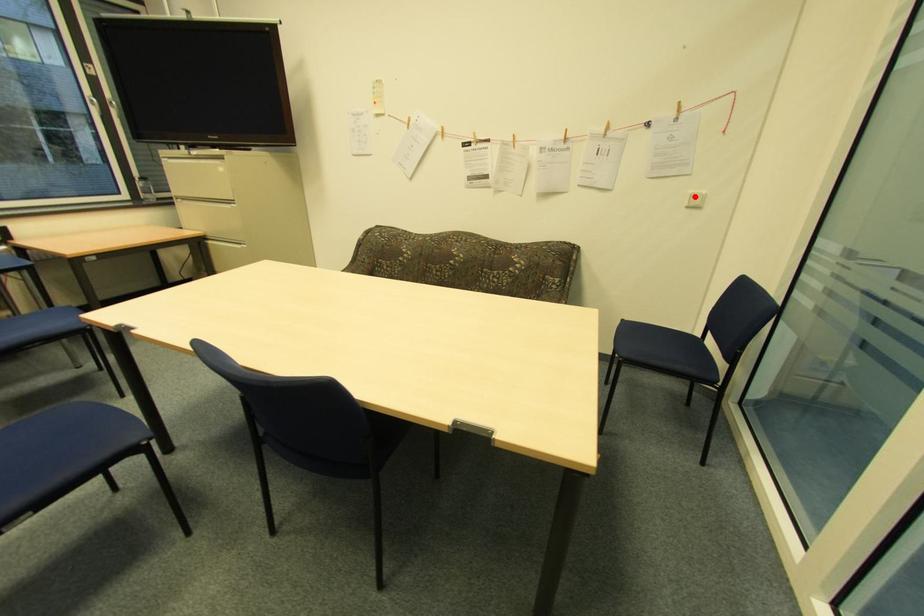
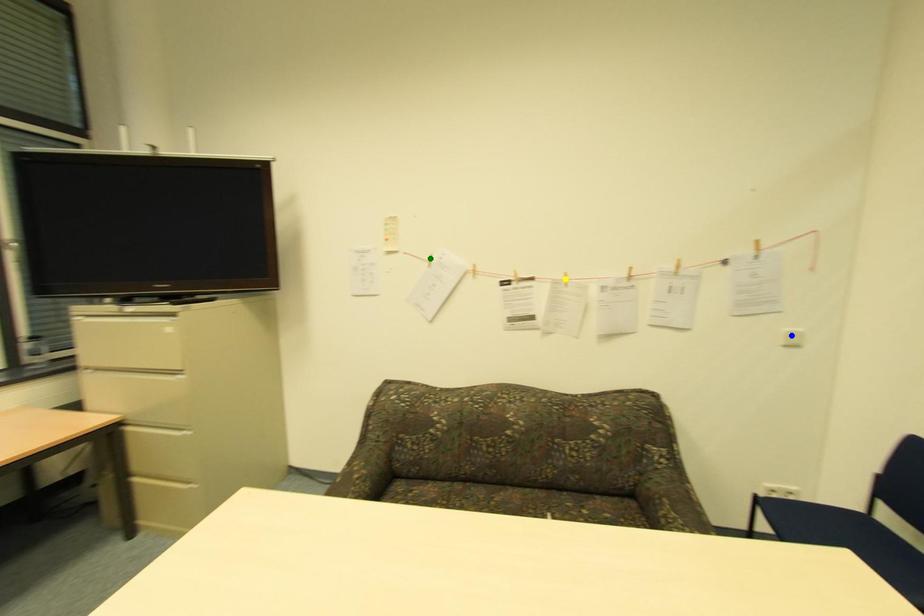
Question: I am providing you with two images of the same scene from different viewpoints. A red point is marked on the first image. You are given multiple points on the second image. Which spot in image 2 lines up with the point in image 1?

Choices:
 (A) yellow point
 (B) green point
 (C) blue point

Answer: (C)